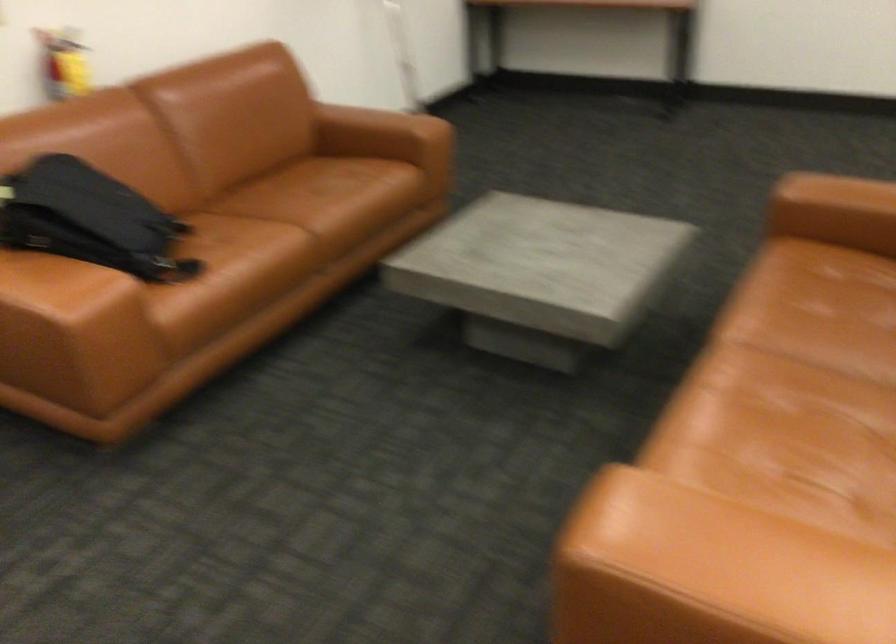
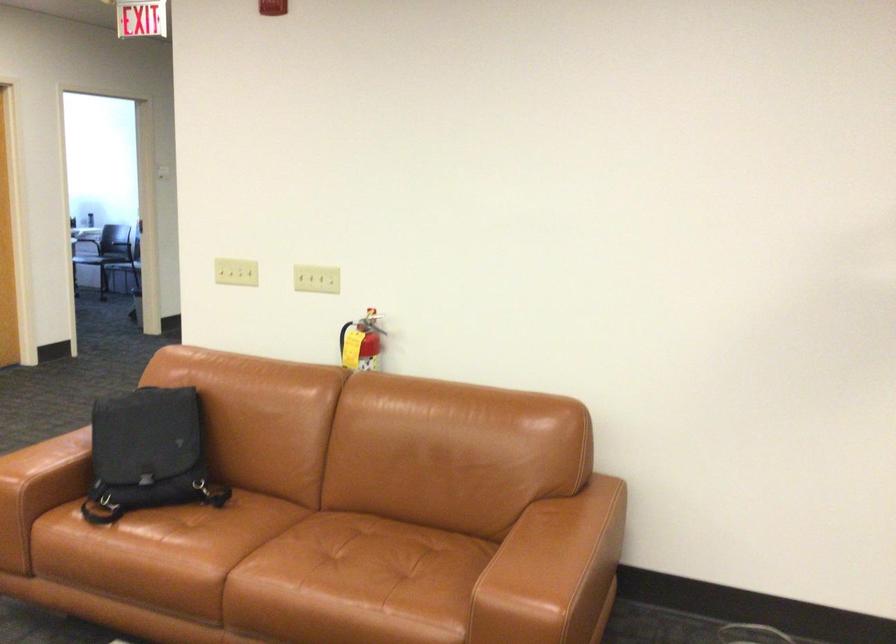
The point at (179, 272) is marked in the first image. Where is the corresponding point in the second image?

(92, 514)